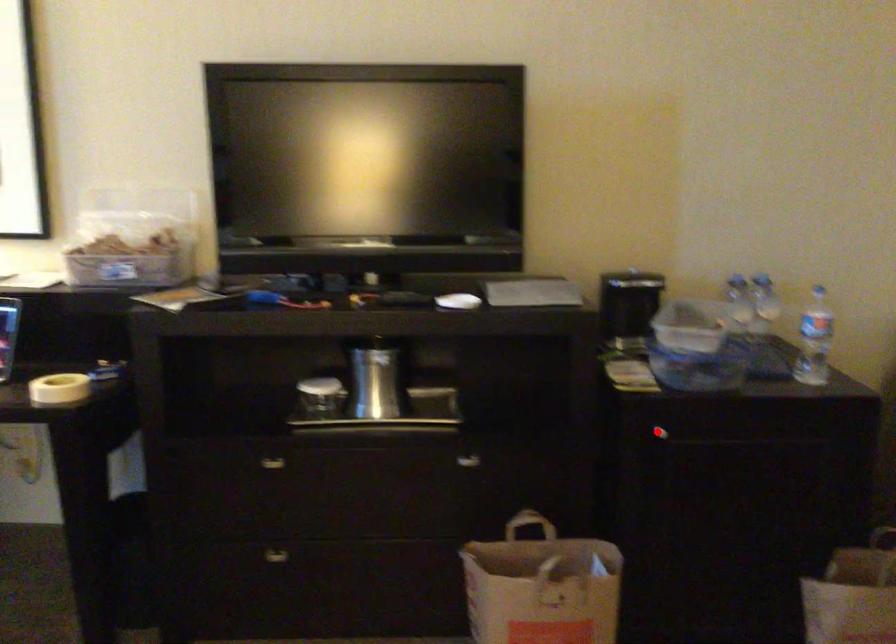
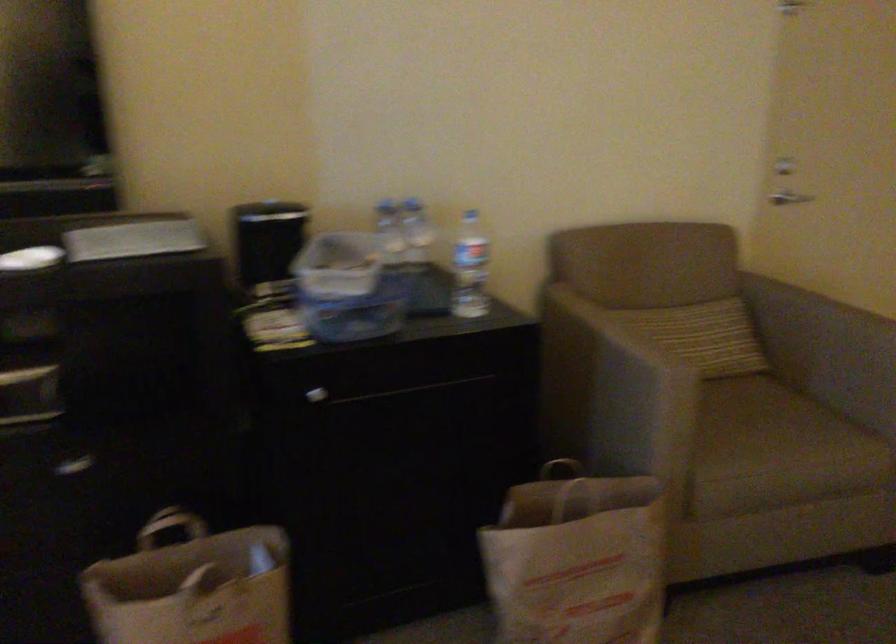
Find the pixel in the second image that matches the highlighted location in the first image.

(316, 395)